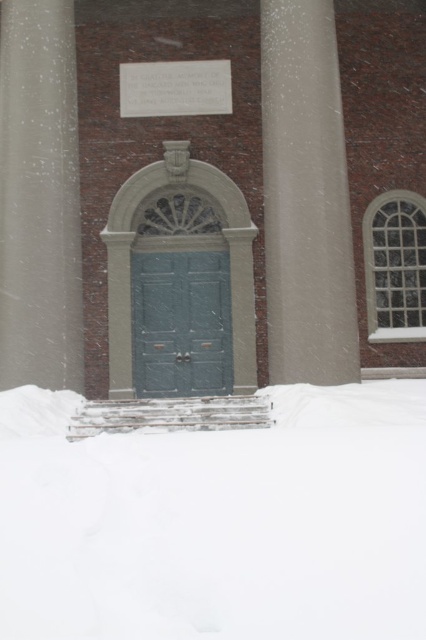
Question: Can you confirm if white fluffy snow at lower center is positioned to the left of smooth concrete pillar at right?

Choices:
 (A) no
 (B) yes

Answer: (B)

Question: Which of the following is the closest to the observer?

Choices:
 (A) smooth concrete pillar at left
 (B) green matte door at center
 (C) smooth concrete pillar at right

Answer: (C)

Question: Which object is closer to the camera taking this photo?

Choices:
 (A) smooth concrete pillar at left
 (B) smooth concrete pillar at right
 (C) white fluffy snow at lower center
 (D) green matte door at center

Answer: (C)

Question: Which object appears farthest from the camera in this image?

Choices:
 (A) white fluffy snow at lower center
 (B) smooth concrete pillar at right
 (C) green matte door at center
 (D) smooth concrete pillar at left

Answer: (C)

Question: Can you confirm if smooth concrete pillar at right is positioned below smooth concrete pillar at left?

Choices:
 (A) no
 (B) yes

Answer: (B)

Question: Does white fluffy snow at lower center come behind green matte door at center?

Choices:
 (A) no
 (B) yes

Answer: (A)